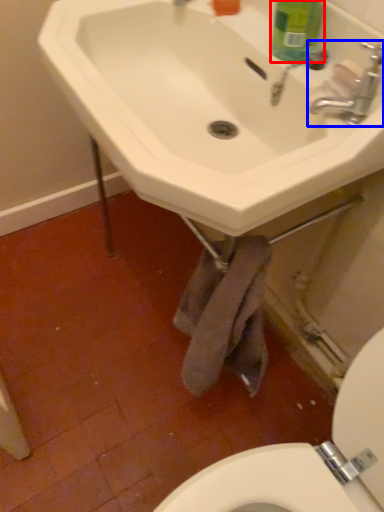
Question: Which object appears closest to the camera in this image, cleaning product (highlighted by a red box) or tap (highlighted by a blue box)?

Choices:
 (A) cleaning product
 (B) tap

Answer: (B)